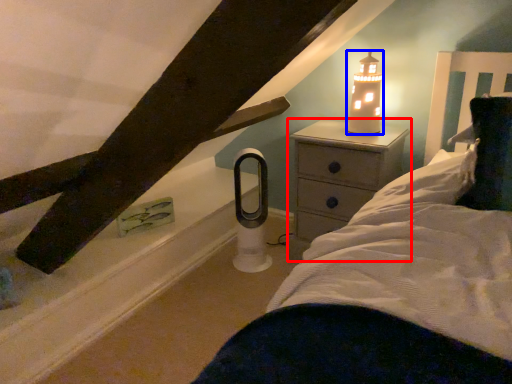
Question: Which of the following is the farthest to the observer, nightstand (highlighted by a red box) or candle holder (highlighted by a blue box)?

Choices:
 (A) nightstand
 (B) candle holder

Answer: (B)